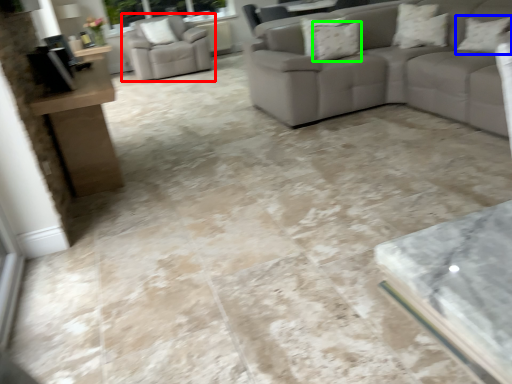
Question: Which is farther away from chair (highlighted by a red box)? pillow (highlighted by a blue box) or pillow (highlighted by a green box)?

Choices:
 (A) pillow
 (B) pillow

Answer: (A)